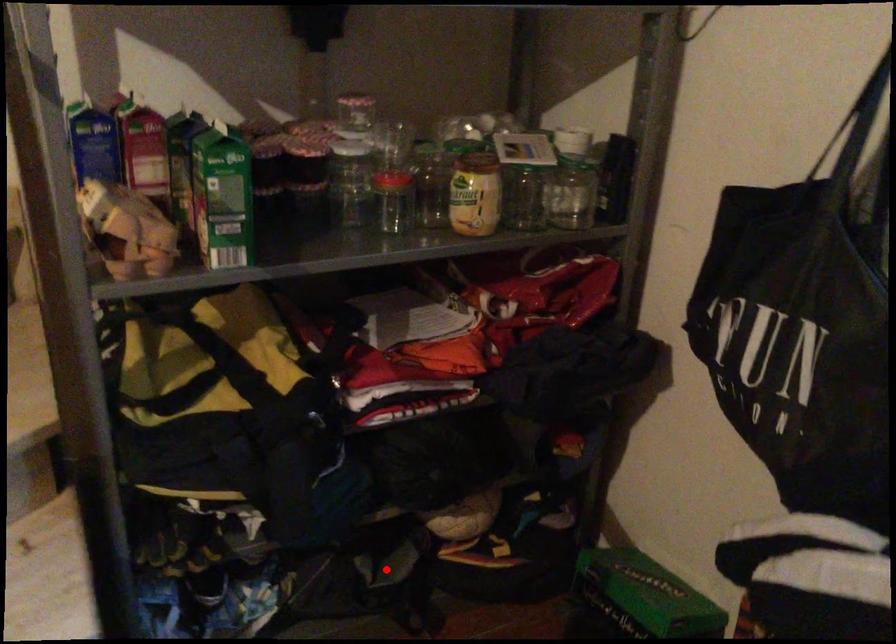
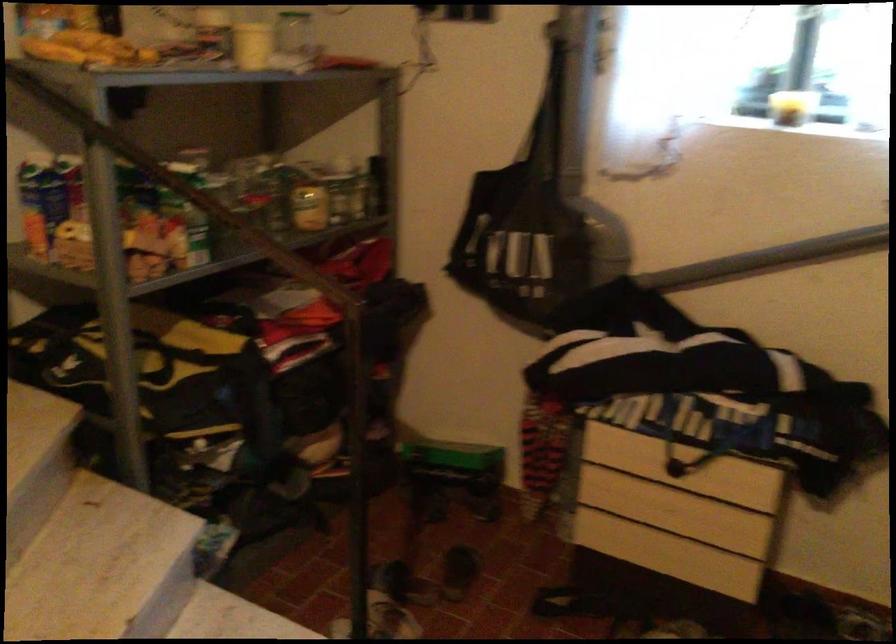
Question: I am providing you with two images of the same scene from different viewpoints. In image1, a red point is highlighted. Considering the same 3D point in image2, which of the following is correct?

Choices:
 (A) It is closer
 (B) It is farther

Answer: (B)